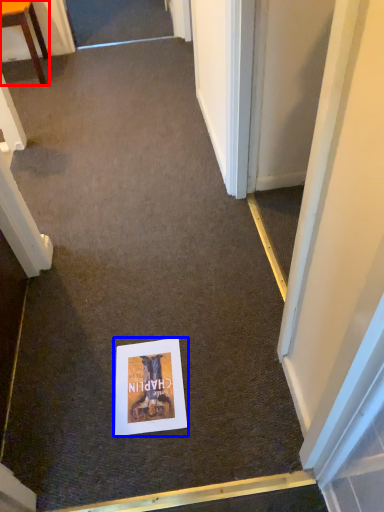
Question: Which of the following is the farthest to the observer, furniture (highlighted by a red box) or poster page (highlighted by a blue box)?

Choices:
 (A) furniture
 (B) poster page

Answer: (A)